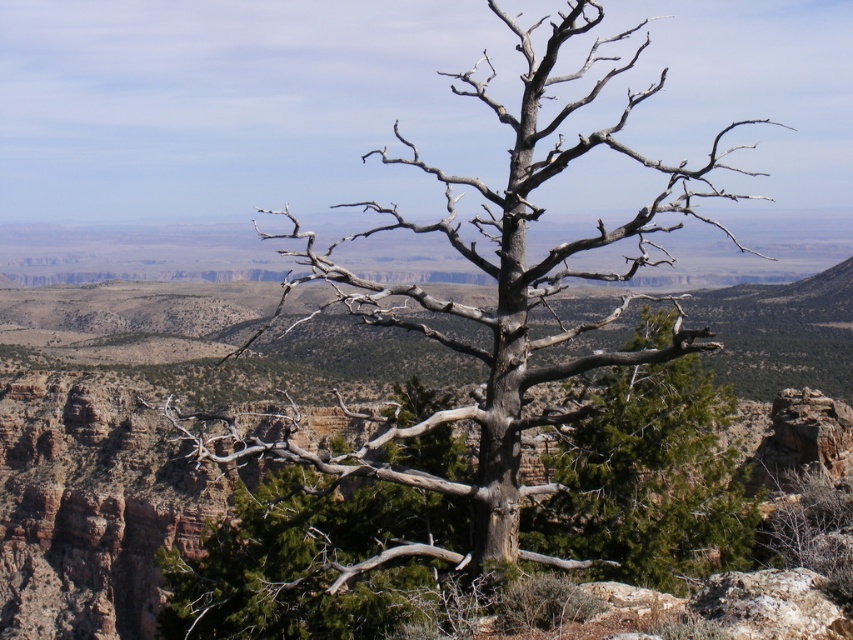
Question: Considering the relative positions of brown rocky canyon at center and gray bark tree at center in the image provided, where is brown rocky canyon at center located with respect to gray bark tree at center?

Choices:
 (A) right
 (B) left

Answer: (B)

Question: Among these points, which one is farthest from the camera?

Choices:
 (A) (270, 376)
 (B) (577, 522)

Answer: (A)

Question: Which object is closer to the camera taking this photo?

Choices:
 (A) gray bark tree at center
 (B) brown rocky canyon at center

Answer: (A)

Question: Is brown rocky canyon at center positioned at the back of gray bark tree at center?

Choices:
 (A) yes
 (B) no

Answer: (A)

Question: Does brown rocky canyon at center appear on the right side of gray bark tree at center?

Choices:
 (A) no
 (B) yes

Answer: (A)